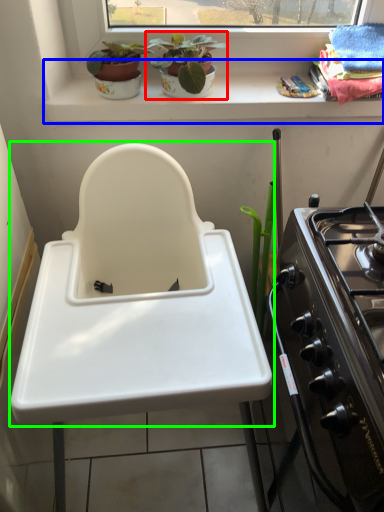
Question: Which object is positioned farthest from houseplant (highlighted by a red box)? Select from window sill (highlighted by a blue box) and sink (highlighted by a green box).

Choices:
 (A) window sill
 (B) sink

Answer: (B)